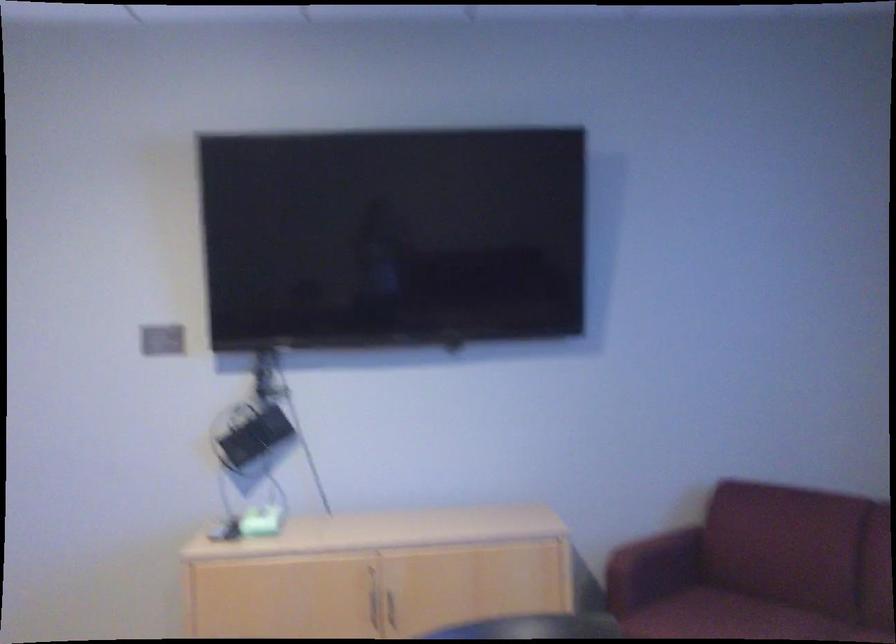
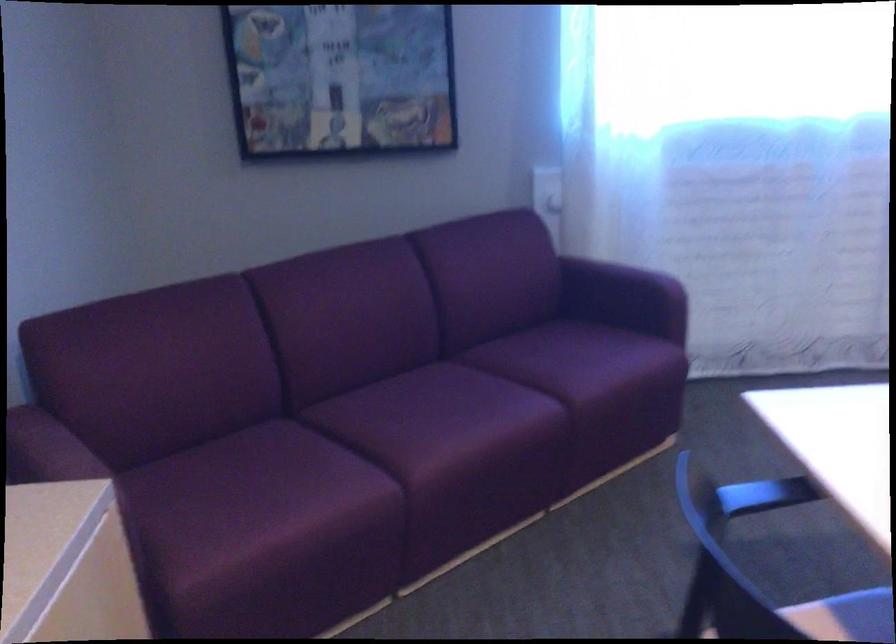
Find the pixel in the second image that matches [651,527] in the first image.

(33, 446)